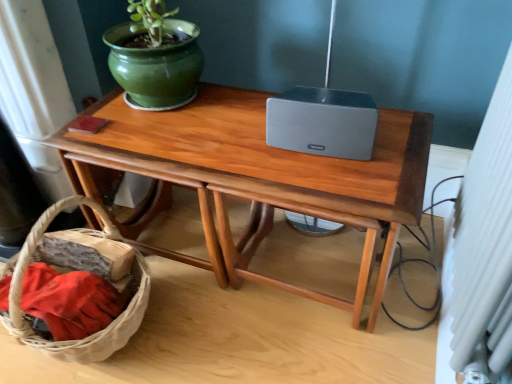
Question: From the image's perspective, is woven brown basket at lower left located above or below wooden table at center?

Choices:
 (A) below
 (B) above

Answer: (A)

Question: From a real-world perspective, is woven brown basket at lower left above or below wooden table at center?

Choices:
 (A) below
 (B) above

Answer: (A)

Question: Which object is positioned farthest from the woven brown basket at lower left?

Choices:
 (A) green glossy flowerpot at upper left
 (B) wooden table at center

Answer: (A)

Question: Which object is positioned closest to the wooden table at center?

Choices:
 (A) green glossy flowerpot at upper left
 (B) woven brown basket at lower left

Answer: (A)